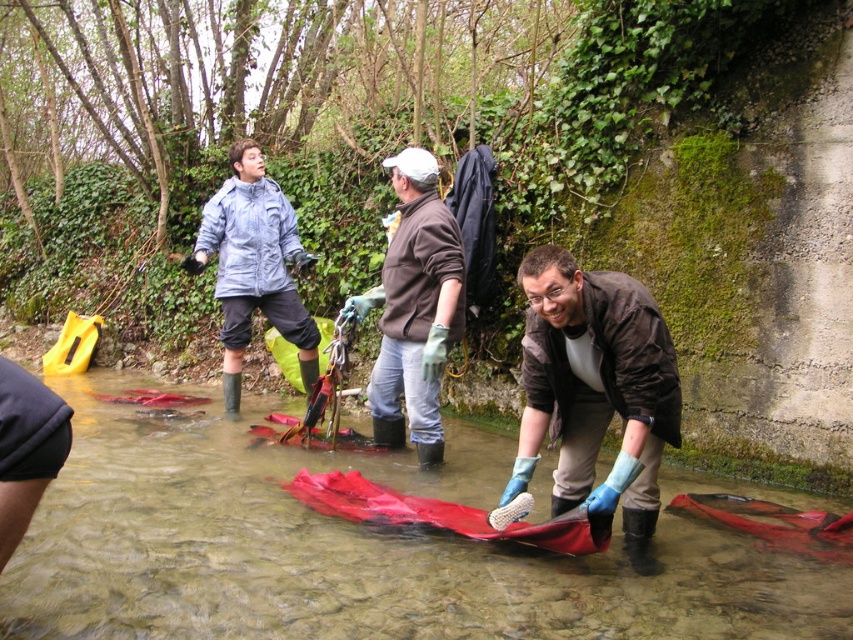
You are a photographer trying to capture a closeup of the red fabric at center without including the blue rubber gloves at center in the frame. Based on their positions, is this possible?

Yes, the red fabric at center is in front of the blue rubber gloves at center, so positioning the camera to focus on the red fabric at center while angling away from the gloves would exclude them from the frame.

You are a photographer trying to capture the scene of the cleanup activity. You want to frame a shot that includes both the blue rubber gloves at center and the light blue waterproof jacket at left. Based on their positions, which object should be placed on the right side of your frame?

The blue rubber gloves at center should be placed on the right side of your frame because it is positioned on the right side of the light blue waterproof jacket at left.

You are a safety inspector checking the safety distance between the blue rubber gloves at center and the light blue waterproof jacket at left. The minimum required distance for safe operation is 10 feet. Is the current distance compliant with safety regulations?

The distance between the blue rubber gloves at center and the light blue waterproof jacket at left is 11.92 feet, which exceeds the minimum required 10 feet, so it is compliant with safety regulations.